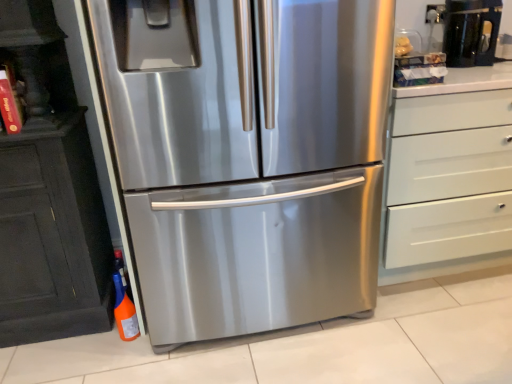
Question: Is black glossy coffee machine at upper right positioned far away from orange matte bottle at lower left?

Choices:
 (A) yes
 (B) no

Answer: (A)

Question: Is the depth of black glossy coffee machine at upper right greater than that of orange matte bottle at lower left?

Choices:
 (A) no
 (B) yes

Answer: (B)

Question: From a real-world perspective, is black glossy coffee machine at upper right under orange matte bottle at lower left?

Choices:
 (A) no
 (B) yes

Answer: (A)

Question: Is black glossy coffee machine at upper right to the right of orange matte bottle at lower left from the viewer's perspective?

Choices:
 (A) no
 (B) yes

Answer: (B)

Question: Is black glossy coffee machine at upper right facing towards orange matte bottle at lower left?

Choices:
 (A) yes
 (B) no

Answer: (B)

Question: Would you say black glossy coffee machine at upper right is inside or outside white matte chest of drawers at right?

Choices:
 (A) inside
 (B) outside

Answer: (B)

Question: In the image, is black glossy coffee machine at upper right on the left side or the right side of white matte chest of drawers at right?

Choices:
 (A) right
 (B) left

Answer: (B)

Question: From the image's perspective, relative to white matte chest of drawers at right, is black glossy coffee machine at upper right above or below?

Choices:
 (A) above
 (B) below

Answer: (A)

Question: Is point (493, 18) closer or farther from the camera than point (501, 104)?

Choices:
 (A) closer
 (B) farther

Answer: (B)

Question: Is point (480, 218) positioned closer to the camera than point (313, 41)?

Choices:
 (A) closer
 (B) farther

Answer: (B)

Question: Would you say white matte chest of drawers at right is to the left or to the right of stainless steel refrigerator at center in the picture?

Choices:
 (A) left
 (B) right

Answer: (B)

Question: From the image's perspective, is white matte chest of drawers at right located above or below stainless steel refrigerator at center?

Choices:
 (A) below
 (B) above

Answer: (A)

Question: Based on their sizes in the image, would you say white matte chest of drawers at right is bigger or smaller than stainless steel refrigerator at center?

Choices:
 (A) small
 (B) big

Answer: (A)

Question: Is white matte chest of drawers at right inside or outside of orange matte bottle at lower left?

Choices:
 (A) inside
 (B) outside

Answer: (B)

Question: Is point (395, 114) closer or farther from the camera than point (131, 309)?

Choices:
 (A) farther
 (B) closer

Answer: (B)